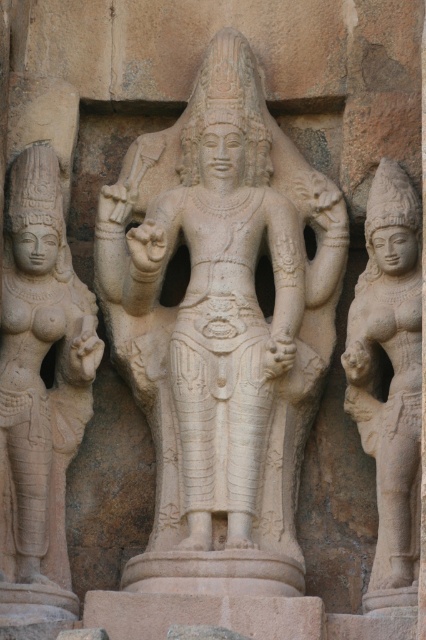
You are a photographer standing at a certain distance from the white stone statue at center. You want to capture a closeup shot of the statue without any distortion. Considering the statue is 89.07 meters away, what is the minimum focal length required for your camera lens to achieve this?

The minimum focal length required would be 89.07 meters to capture a closeup shot of the white stone statue at center without distortion, as the distance between the statue and the camera is exactly that.